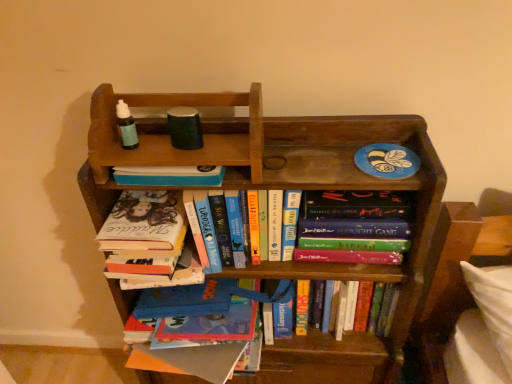
Question: Is hardcover book at center, positioned as the first book in top-to-bottom order, completely or partially outside of hardcover book at center, arranged as the first book when ordered from the bottom?

Choices:
 (A) no
 (B) yes

Answer: (B)

Question: Is hardcover book at center, acting as the 3th book starting from the bottom, to the right of hardcover book at center, which appears as the 3th book when viewed from the top, from the viewer's perspective?

Choices:
 (A) no
 (B) yes

Answer: (A)

Question: Is hardcover book at center, acting as the 3th book starting from the bottom, thinner than hardcover book at center, which appears as the 3th book when viewed from the top?

Choices:
 (A) no
 (B) yes

Answer: (A)

Question: Does hardcover book at center, positioned as the first book in top-to-bottom order, have a larger size compared to hardcover book at center, which appears as the 3th book when viewed from the top?

Choices:
 (A) no
 (B) yes

Answer: (A)

Question: Is hardcover book at center, acting as the 3th book starting from the bottom, not close to hardcover book at center, which appears as the 3th book when viewed from the top?

Choices:
 (A) no
 (B) yes

Answer: (A)

Question: Considering the relative sizes of hardcover book at center, acting as the 3th book starting from the bottom, and hardcover book at center, which appears as the 3th book when viewed from the top, in the image provided, is hardcover book at center, acting as the 3th book starting from the bottom, shorter than hardcover book at center, which appears as the 3th book when viewed from the top,?

Choices:
 (A) no
 (B) yes

Answer: (B)

Question: Does hardcover book at center, positioned as the first book in top-to-bottom order, appear on the left side of wooden bookcase at center?

Choices:
 (A) yes
 (B) no

Answer: (A)

Question: Is hardcover book at center, acting as the 3th book starting from the bottom, facing away from wooden bookcase at center?

Choices:
 (A) no
 (B) yes

Answer: (B)

Question: From a real-world perspective, does hardcover book at center, positioned as the first book in top-to-bottom order, stand above wooden bookcase at center?

Choices:
 (A) no
 (B) yes

Answer: (B)

Question: Is hardcover book at center, positioned as the first book in top-to-bottom order, facing towards wooden bookcase at center?

Choices:
 (A) no
 (B) yes

Answer: (B)

Question: From the image's perspective, does hardcover book at center, acting as the 3th book starting from the bottom, appear lower than wooden bookcase at center?

Choices:
 (A) yes
 (B) no

Answer: (B)

Question: Is wooden bookcase at center a part of hardcover book at center, positioned as the first book in top-to-bottom order?

Choices:
 (A) yes
 (B) no

Answer: (B)

Question: Could you tell me if hardcover book at center, arranged as the first book when ordered from the bottom, is facing wooden bookcase at center?

Choices:
 (A) yes
 (B) no

Answer: (A)